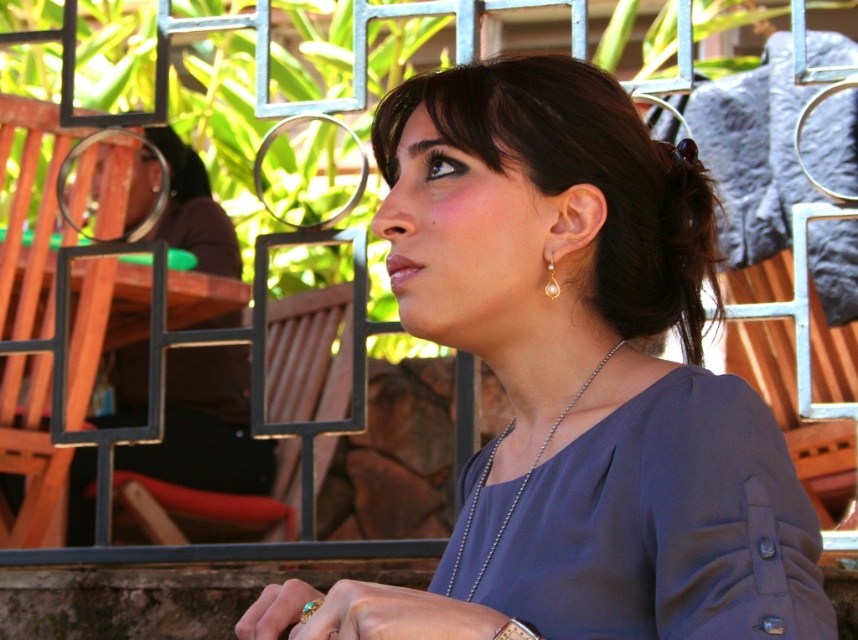
Consider the image. Does matte blue dress at center lie behind silver metallic bracelet at lower center?

Yes, it is behind silver metallic bracelet at lower center.

Can you confirm if matte blue dress at center is positioned to the right of silver metallic bracelet at lower center?

Yes, matte blue dress at center is to the right of silver metallic bracelet at lower center.

Between point (603, 637) and point (506, 630), which one is positioned behind?

Positioned behind is point (603, 637).

At what (x,y) coordinates should I click in order to perform the action: click on matte blue dress at center. Please return your answer as a coordinate pair (x, y). The width and height of the screenshot is (858, 640). Looking at the image, I should click on (666, 525).

In the scene shown: Who is more forward, (601,616) or (524,624)?

Positioned in front is point (524,624).

Which is behind, point (645, 172) or point (515, 625)?

Positioned behind is point (645, 172).

Where is `matte purple blouse at center`? matte purple blouse at center is located at coordinates (573, 380).

Between metallic wood chair at center and pearl gold earring at right, which one is positioned higher?

pearl gold earring at right

Which is below, metallic wood chair at center or pearl gold earring at right?

metallic wood chair at center is below.

This screenshot has width=858, height=640. Describe the element at coordinates (309, 355) in the screenshot. I see `metallic wood chair at center` at that location.

The width and height of the screenshot is (858, 640). Find the location of `metallic wood chair at center`. metallic wood chair at center is located at coordinates (309, 355).